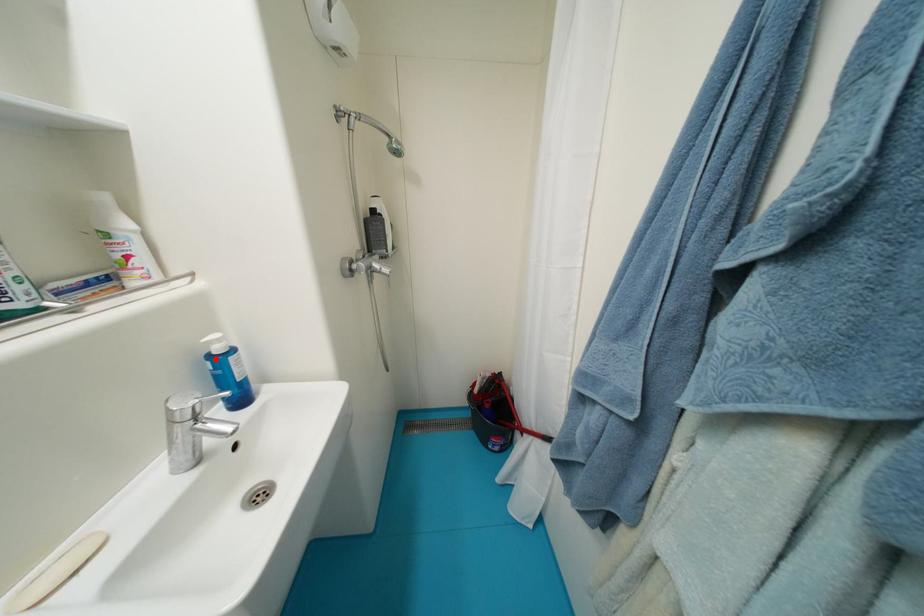
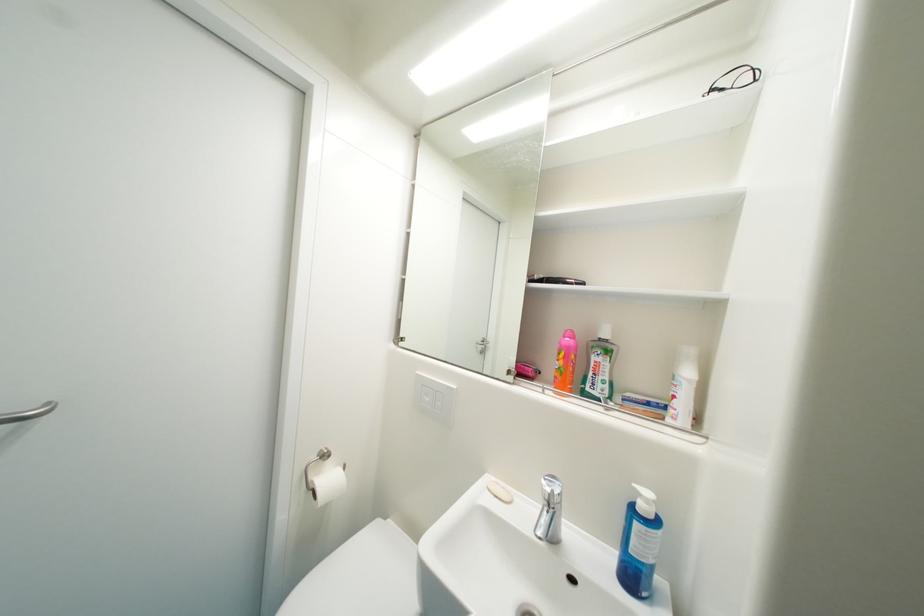
Where in the second image is the point corresponding to the highlighted location from the first image?

(641, 507)